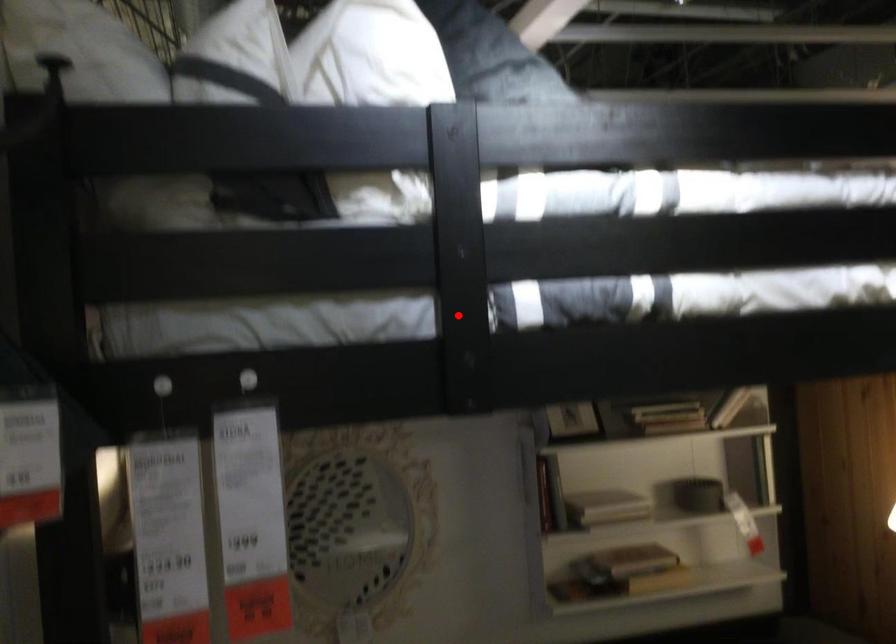
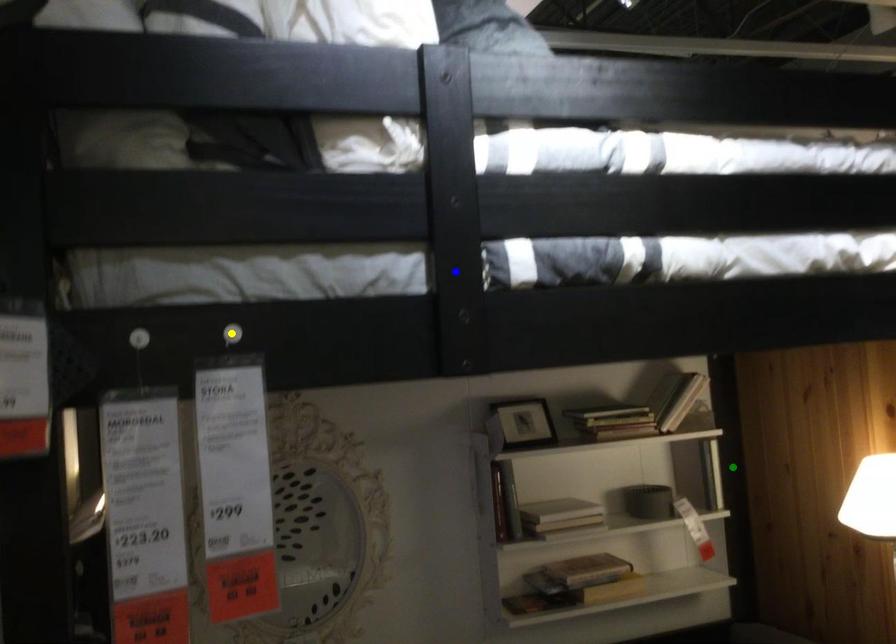
Question: I am providing you with two images of the same scene from different viewpoints. A red point is marked on the first image. You are given multiple points on the second image. Which mark in image 2 goes with the point in image 1?

Choices:
 (A) green point
 (B) yellow point
 (C) blue point

Answer: (C)